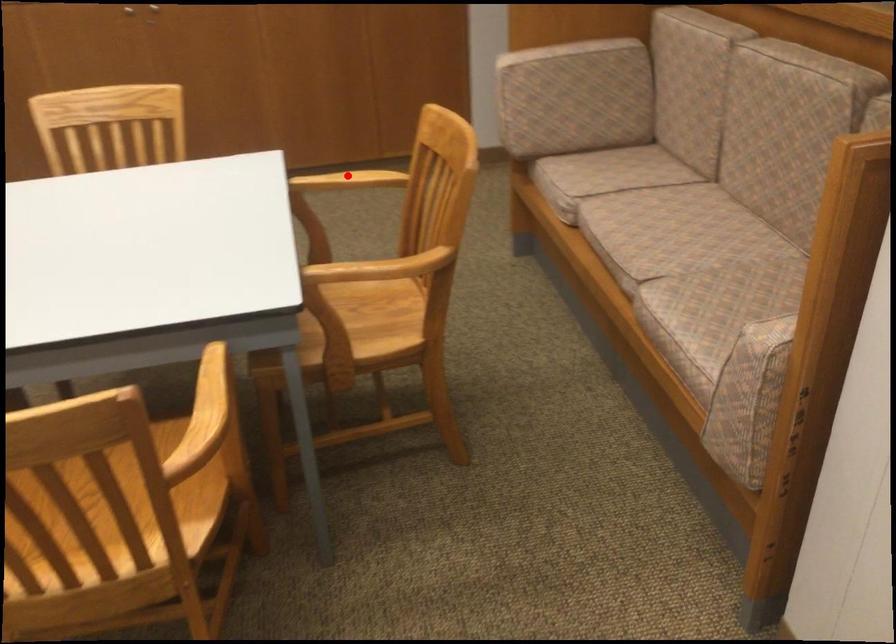
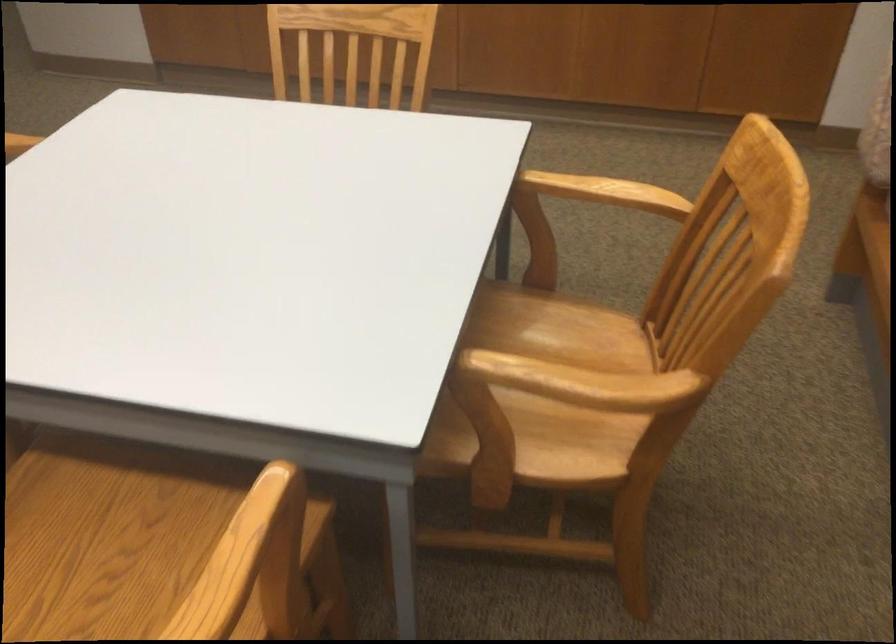
Question: I am providing you with two images of the same scene from different viewpoints. Given a red point in image1, look at the same physical point in image2. Is it:

Choices:
 (A) Closer to the viewpoint
 (B) Farther from the viewpoint

Answer: (A)